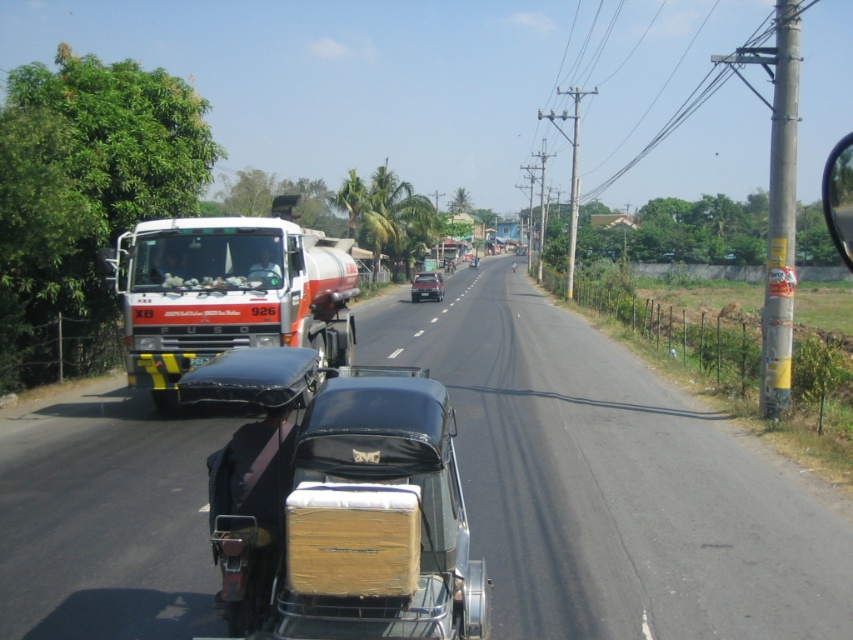
You are a delivery driver who needs to pass through a narrow bridge ahead. The bridge can only support vehicles up to the size of the shiny silver sedan at center. Can your white glossy fuel tanker at left safely cross the bridge?

The white glossy fuel tanker at left is larger in size than the shiny silver sedan at center. Since the bridge can only support vehicles up to the size of the shiny silver sedan at center, the white glossy fuel tanker at left cannot safely cross the bridge.

You are driving a car and see two points on the road ahead. The first point is at coordinate point (399, 602) and the second point is at coordinate point (422, 296). Which point is closer to your car?

Point (399, 602) is in front of point (422, 296), so the first point is closer to your car.

You are a delivery driver needing to park your vehicle in a narrow parking spot that can only accommodate a car narrower than 1.8 meters. You see the matte black car at center and the shiny silver sedan at center in the scene. Which vehicle should you choose to park in the spot?

The matte black car at center has a width less than the shiny silver sedan at center, so you should choose the matte black car at center to park in the narrow spot since it is narrower than 1.8 meters.